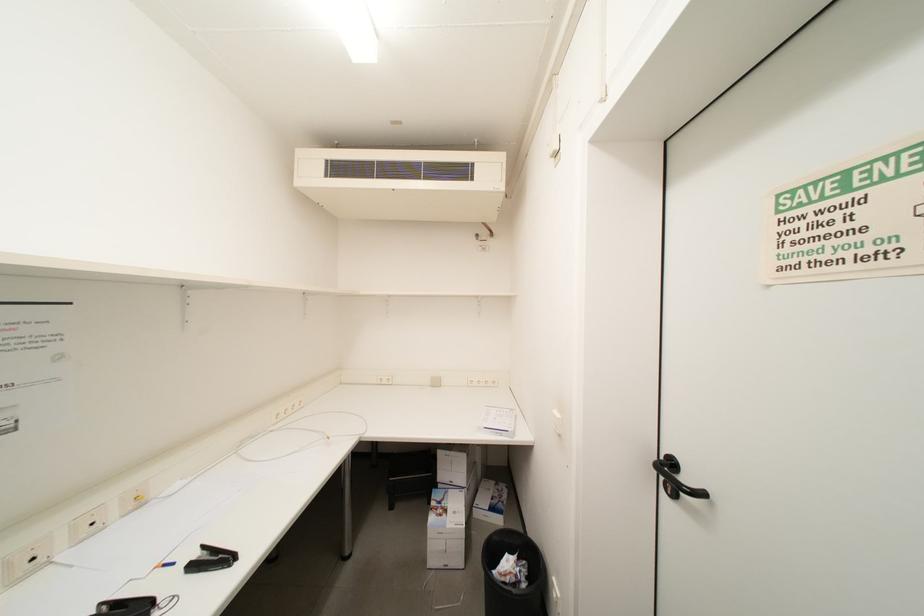
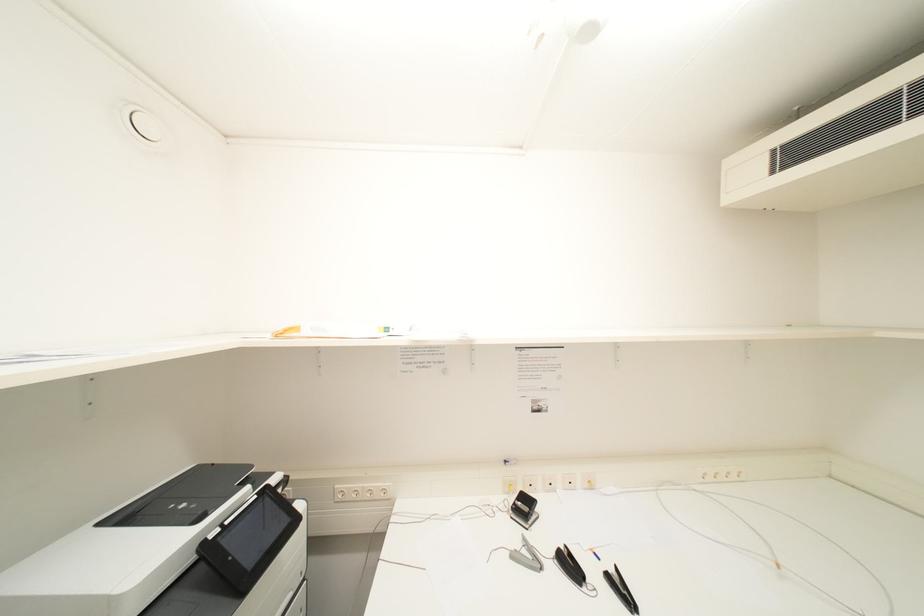
Question: Based on the continuous images, in which direction is the camera rotating? Reply with the corresponding letter.

Choices:
 (A) Left
 (B) Right
 (C) Up
 (D) Down

Answer: (A)